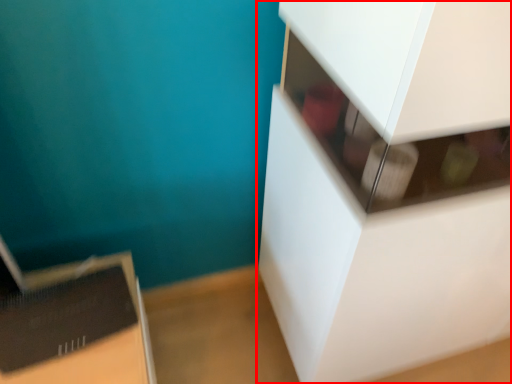
Question: From the image's perspective, where is furniture (annotated by the red box) located in relation to cardboard box in the image?

Choices:
 (A) above
 (B) below

Answer: (A)